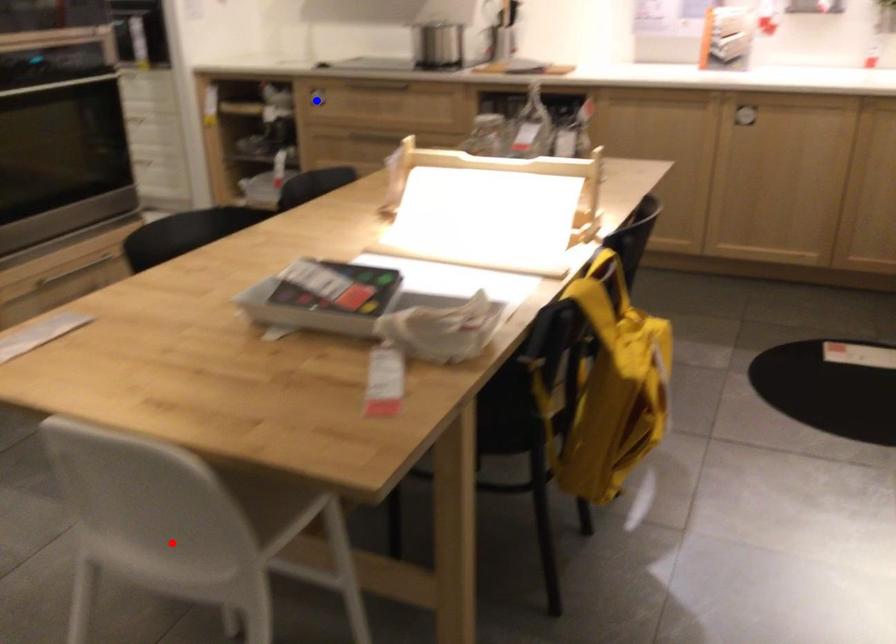
Question: Which of the two points in the image is closer to the camera?

Choices:
 (A) Blue point is closer.
 (B) Red point is closer.

Answer: (B)